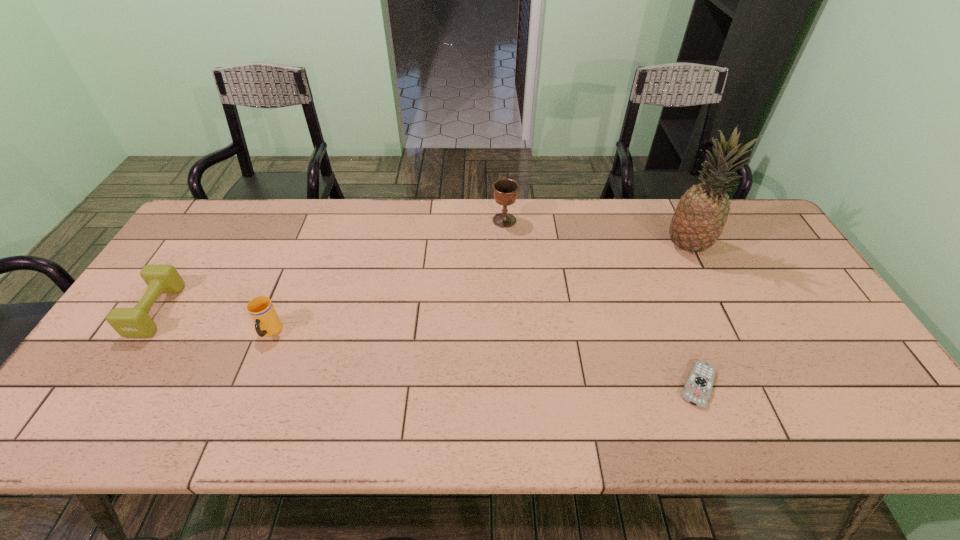
What are the coordinates of `the tallest object` in the screenshot? It's located at (701, 214).

The width and height of the screenshot is (960, 540). I want to click on the second farthest object, so click(x=701, y=214).

Where is `the fourth shortest object`? the fourth shortest object is located at coordinates (505, 191).

Image resolution: width=960 pixels, height=540 pixels. What are the coordinates of `chalice` in the screenshot? It's located at (505, 191).

Find the location of a particular element. cup is located at coordinates coord(267,322).

Locate an element on the screen. the leftmost object is located at coordinates (135, 322).

Where is `dumbbell`? The width and height of the screenshot is (960, 540). dumbbell is located at coordinates (135, 322).

Find the location of a particular element. The image size is (960, 540). remote control is located at coordinates (698, 387).

Find the location of a particular element. The height and width of the screenshot is (540, 960). the shortest object is located at coordinates (698, 387).

Image resolution: width=960 pixels, height=540 pixels. Find the location of `free space located 0.400m on the left of the pineapple`. free space located 0.400m on the left of the pineapple is located at coordinates (536, 246).